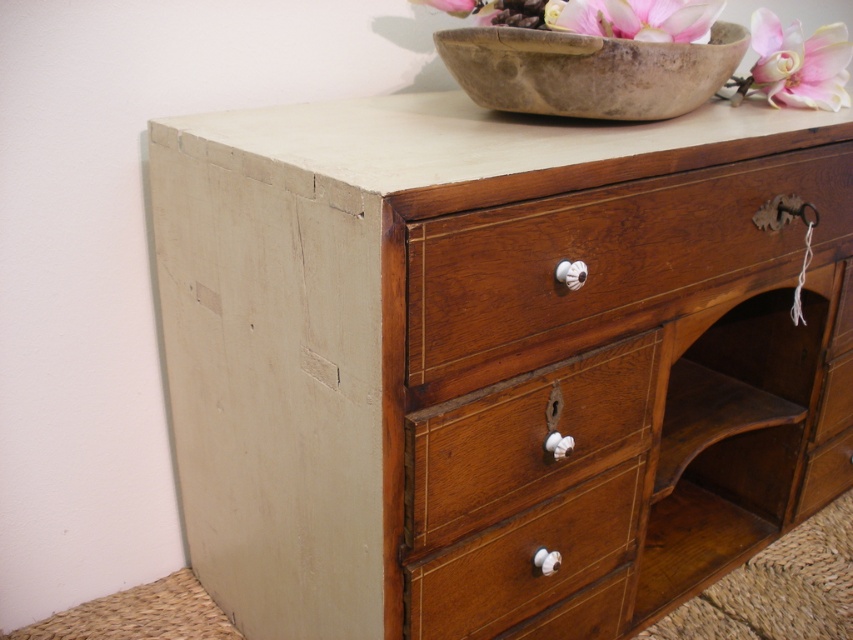
You are an interior designer planning to install a decorative shelf between the wooden dresser at upper center and the wooden drawer at center. What is the minimum width the shelf must be to fit between them?

The minimum width required for the shelf is 7.31 inches to fit between the wooden dresser at upper center and the wooden drawer at center.

You are an interior designer assessing the placement of the wooden dresser at upper center and the mahogany wood drawer at center in a room. Based on their heights, which one would require a higher ceiling to accommodate its size?

The wooden dresser at upper center requires a higher ceiling because it is much taller than the mahogany wood drawer at center.